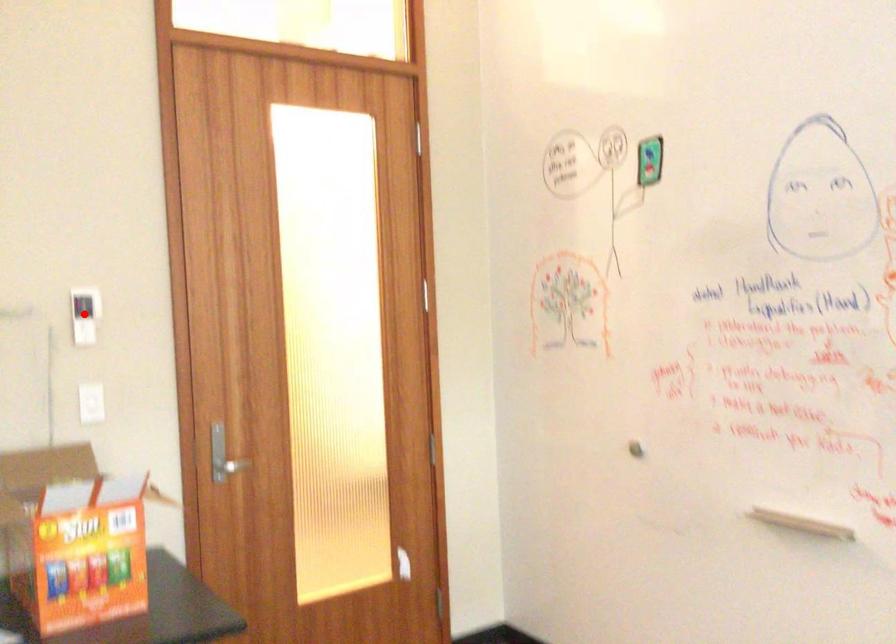
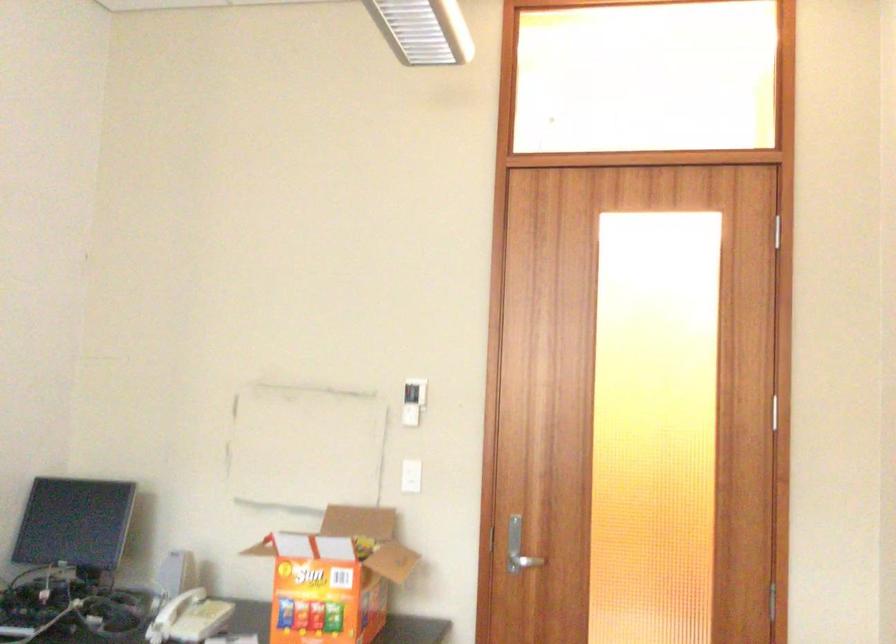
Locate, in the second image, the point that corresponds to the highlighted location in the first image.

(412, 401)